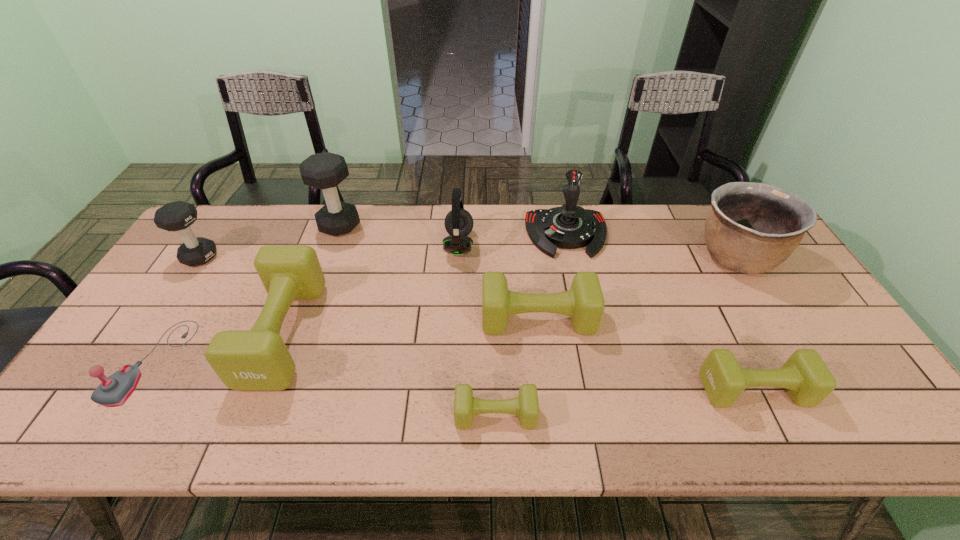
Find the location of a particular element. The image size is (960, 540). free space between the leftmost dumbbell and the second smallest olive dumbbell is located at coordinates (477, 323).

This screenshot has width=960, height=540. Identify the location of free space between the black headset and the smaller gray dumbbell. (329, 251).

I want to click on the sixth closest object to the pottery, so click(326, 170).

Choose which object is the second nearest neighbor to the right joystick. Please provide its 2D coordinates. Your answer should be formatted as a tuple, i.e. [(x, y)], where the tuple contains the x and y coordinates of a point satisfying the conditions above.

[(584, 302)]

Where is `dumbbell that is the fourth closest to the rightmost olive dumbbell`? dumbbell that is the fourth closest to the rightmost olive dumbbell is located at coordinates (326, 170).

Locate which dumbbell ranks third in proximity to the left joystick. Please provide its 2D coordinates. Your answer should be formatted as a tuple, i.e. [(x, y)], where the tuple contains the x and y coordinates of a point satisfying the conditions above.

[(326, 170)]

Identify which olive dumbbell is located as the nearest to the fourth tallest dumbbell. Please provide its 2D coordinates. Your answer should be formatted as a tuple, i.e. [(x, y)], where the tuple contains the x and y coordinates of a point satisfying the conditions above.

[(525, 406)]

Where is `the third closest olive dumbbell relative to the seventh tallest object`? The width and height of the screenshot is (960, 540). the third closest olive dumbbell relative to the seventh tallest object is located at coordinates (257, 359).

Find the location of a particular element. blank area in the image that satisfies the following two spatial constraints: 1. on the handle side of the farther joystick; 2. on the ear cups of the headset is located at coordinates (569, 245).

Locate an element on the screen. Image resolution: width=960 pixels, height=540 pixels. blank space that satisfies the following two spatial constraints: 1. on the handle side of the second shortest dumbbell; 2. on the left side of the taller joystick is located at coordinates (601, 390).